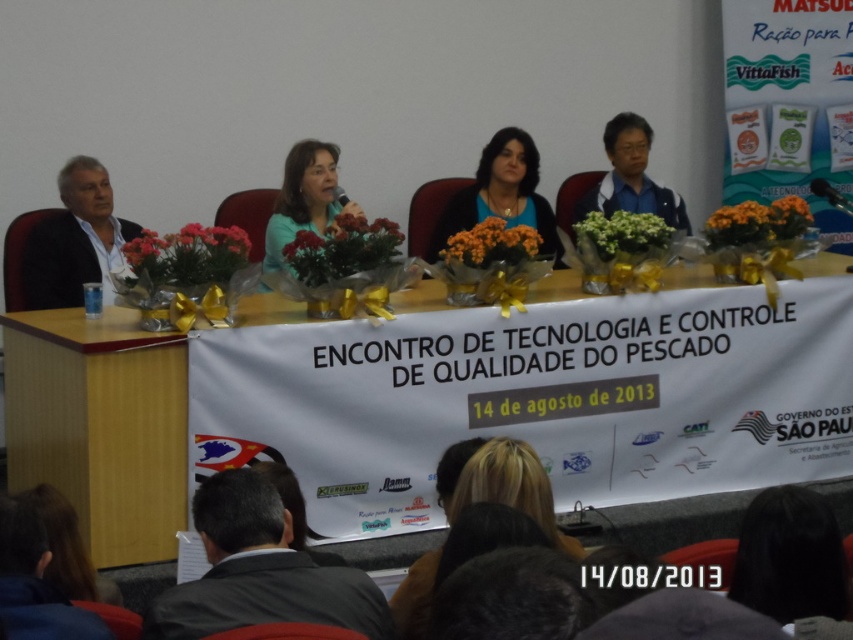
You are an event photographer at the Technology and Quality Control Meeting for Fish. You need to capture a clear photo of the panelist with the blonde hair at center and the blue matte shirt at center. Which object should you focus on first to ensure both are in frame?

The blonde hair at center has a lesser width compared to the blue matte shirt at center, so you should focus on the blue matte shirt at center first to ensure both are in frame.

You are an event organizer standing at the back of the room. You need to place a 1.8 meter long banner between the blonde hair at center and the matte green shirt at center. Can the banner fit between them without overlapping either?

The distance between the blonde hair at center and the matte green shirt at center is 1.91 meters. Since the banner is 1.8 meters long, it can fit between them with a small gap of 0.11 meters remaining.

You are attending the Technology and Quality Control Meeting for Fish and need to move from your current position to the front of the room. You notice two points marked on the floor at coordinates point (485, 452) and point (347, 209). Which point should you walk towards to get closer to the front of the room?

You should walk towards point (347, 209) because it is behind point (485, 452), meaning point (347, 209) is closer to the front of the room.